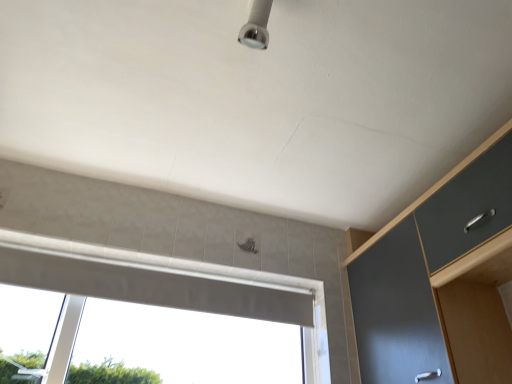
Question: From the image's perspective, relative to matte gray cabinet at right, is white glossy window at center above or below?

Choices:
 (A) below
 (B) above

Answer: (A)

Question: From a real-world perspective, is white glossy window at center physically located above or below matte gray cabinet at right?

Choices:
 (A) above
 (B) below

Answer: (B)

Question: Visually, is white glossy window at center positioned to the left or to the right of matte gray cabinet at right?

Choices:
 (A) left
 (B) right

Answer: (A)

Question: Based on their sizes in the image, would you say matte gray cabinet at right is bigger or smaller than white glossy window at center?

Choices:
 (A) big
 (B) small

Answer: (A)

Question: Considering their positions, is matte gray cabinet at right located in front of or behind white glossy window at center?

Choices:
 (A) front
 (B) behind

Answer: (A)

Question: In terms of width, does matte gray cabinet at right look wider or thinner when compared to white glossy window at center?

Choices:
 (A) wide
 (B) thin

Answer: (A)

Question: Based on their positions, is matte gray cabinet at right located to the left or right of white glossy window at center?

Choices:
 (A) right
 (B) left

Answer: (A)